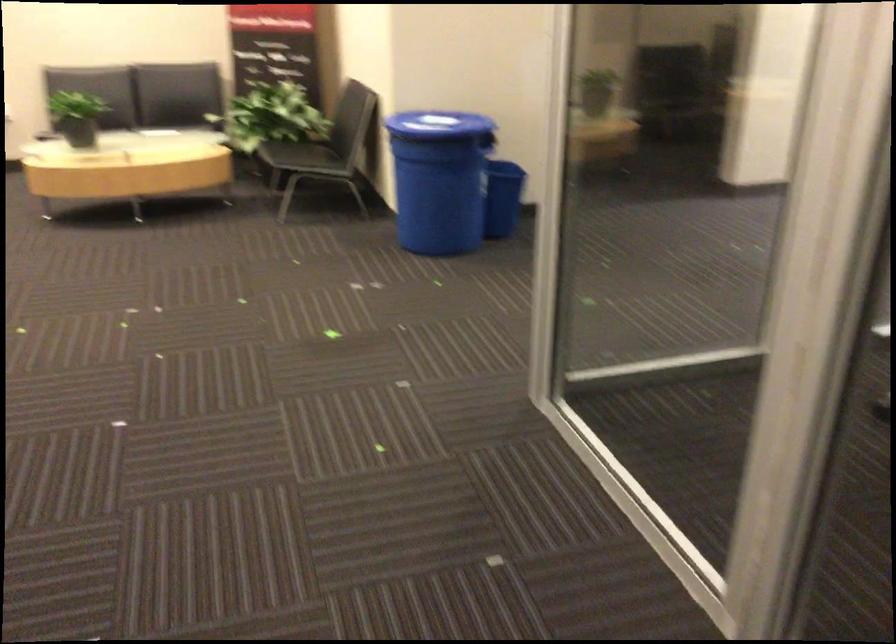
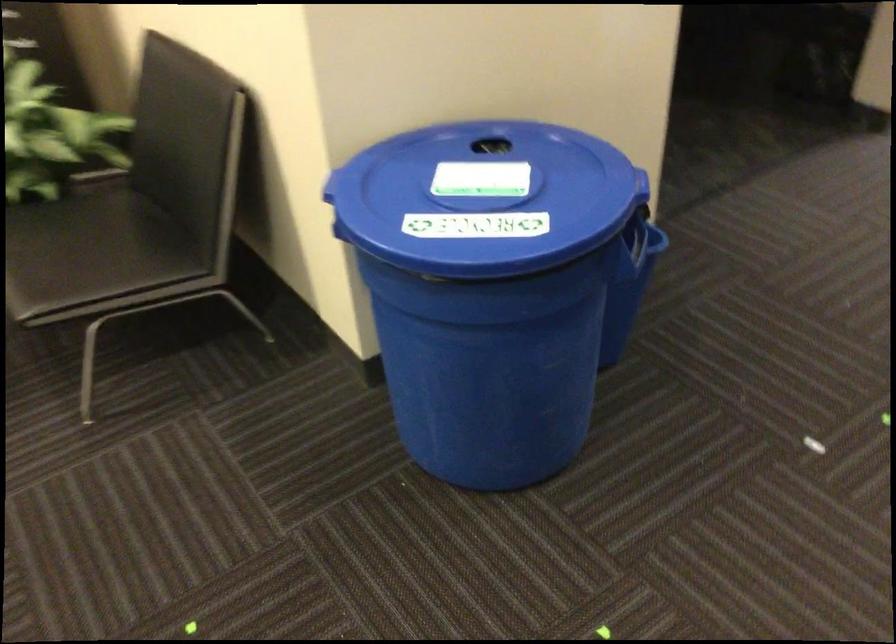
Question: What movement of the cameraman would produce the second image?

Choices:
 (A) Left
 (B) Right
 (C) Forward
 (D) Backward

Answer: (C)